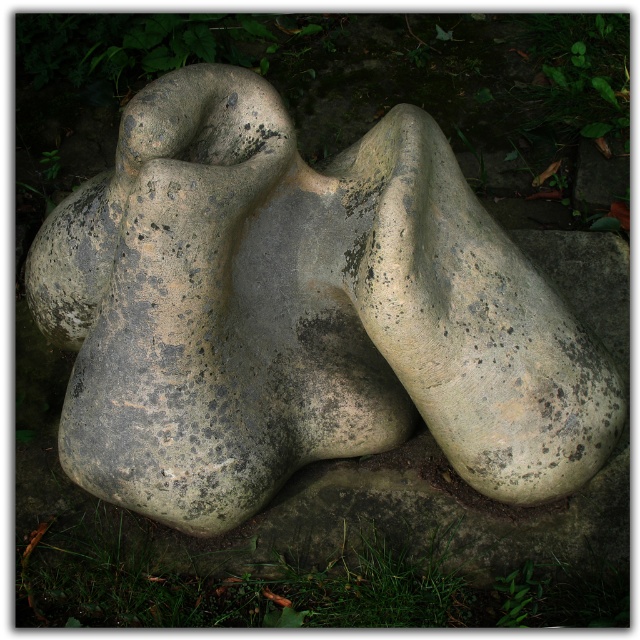
Is gray stone sculpture at center smaller than green grass at lower center?

Incorrect, gray stone sculpture at center is not smaller in size than green grass at lower center.

Is gray stone sculpture at center below green grass at lower center?

No.

Between point (403, 248) and point (320, 595), which one is positioned behind?

Positioned behind is point (320, 595).

The image size is (640, 640). Identify the location of gray stone sculpture at center. (300, 314).